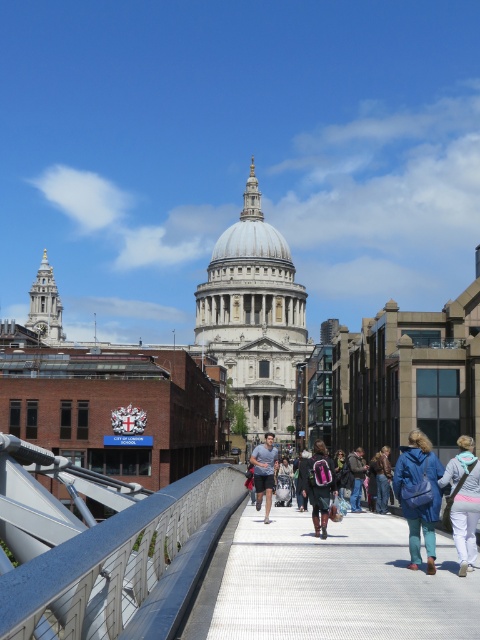
Question: Which object appears closest to the camera in this image?

Choices:
 (A) white textured pavement at center
 (B) metallic gray bridge at center

Answer: (B)

Question: Is the position of metallic gray bridge at center more distant than that of blue fabric backpack at lower right?

Choices:
 (A) yes
 (B) no

Answer: (B)

Question: Among these points, which one is farthest from the camera?

Choices:
 (A) (363, 474)
 (B) (319, 461)

Answer: (A)

Question: Does blue denim jeans at center have a smaller size compared to pink fabric backpack at center?

Choices:
 (A) yes
 (B) no

Answer: (B)

Question: Is white textured pavement at center below denim jacket at center?

Choices:
 (A) yes
 (B) no

Answer: (A)

Question: Based on their relative distances, which object is nearer to the blue fabric jacket at lower right?

Choices:
 (A) gray fabric shorts at center
 (B) denim jacket at center
 (C) blue denim jeans at center
 (D) metallic gray bridge at center

Answer: (C)